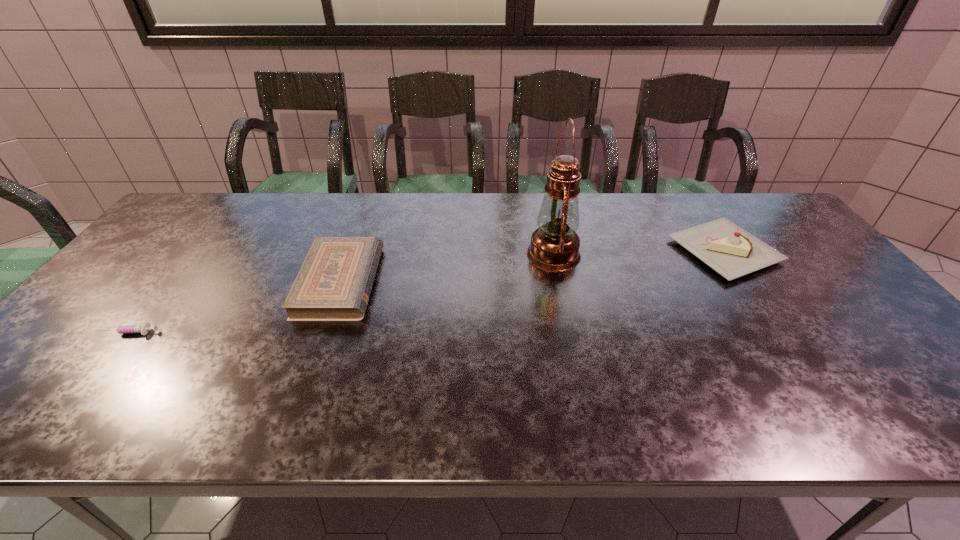
In the image, there is a desktop. Where is `vacant space at the near left corner`? The image size is (960, 540). vacant space at the near left corner is located at coordinates 1,418.

The width and height of the screenshot is (960, 540). Find the location of `vacant area between the Bible and the syringe`. vacant area between the Bible and the syringe is located at coordinates (234, 307).

Where is `free space between the third shortest object and the second shortest object`? This screenshot has height=540, width=960. free space between the third shortest object and the second shortest object is located at coordinates (533, 266).

Locate an element on the screen. Image resolution: width=960 pixels, height=540 pixels. vacant area between the rightmost object and the shortest object is located at coordinates (427, 292).

At what (x,y) coordinates should I click in order to perform the action: click on vacant space that is in between the oil lamp and the cake. Please return your answer as a coordinate pair (x, y). This screenshot has width=960, height=540. Looking at the image, I should click on (639, 253).

You are a GUI agent. You are given a task and a screenshot of the screen. Output one action in this format:
    pyautogui.click(x=<x>, y=<y>)
    Task: Click on the free space between the cake and the leftmost object
    The width and height of the screenshot is (960, 540).
    Given the screenshot: What is the action you would take?
    pyautogui.click(x=427, y=292)

At what (x,y) coordinates should I click in order to perform the action: click on vacant area that lies between the Bible and the third shortest object. Please return your answer as a coordinate pair (x, y). This screenshot has height=540, width=960. Looking at the image, I should click on (533, 266).

Locate an element on the screen. Image resolution: width=960 pixels, height=540 pixels. vacant space that's between the rightmost object and the tallest object is located at coordinates (639, 253).

Locate an element on the screen. free space between the cake and the Bible is located at coordinates (533, 266).

You are a GUI agent. You are given a task and a screenshot of the screen. Output one action in this format:
    pyautogui.click(x=<x>, y=<y>)
    Task: Click on the vacant area between the nearest object and the third object from right to left
    The height and width of the screenshot is (540, 960).
    Given the screenshot: What is the action you would take?
    pyautogui.click(x=234, y=307)